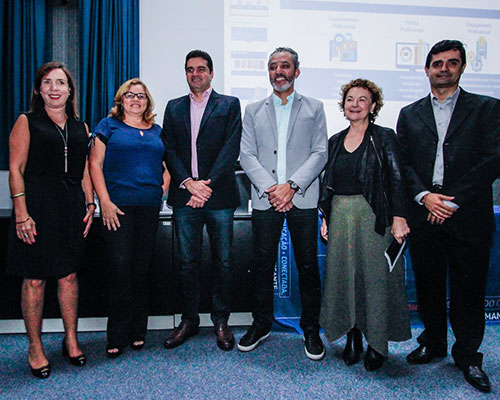
This screenshot has width=500, height=400. In order to click on presentation projected onto the wall in this screenshot , I will do `click(319, 23)`.